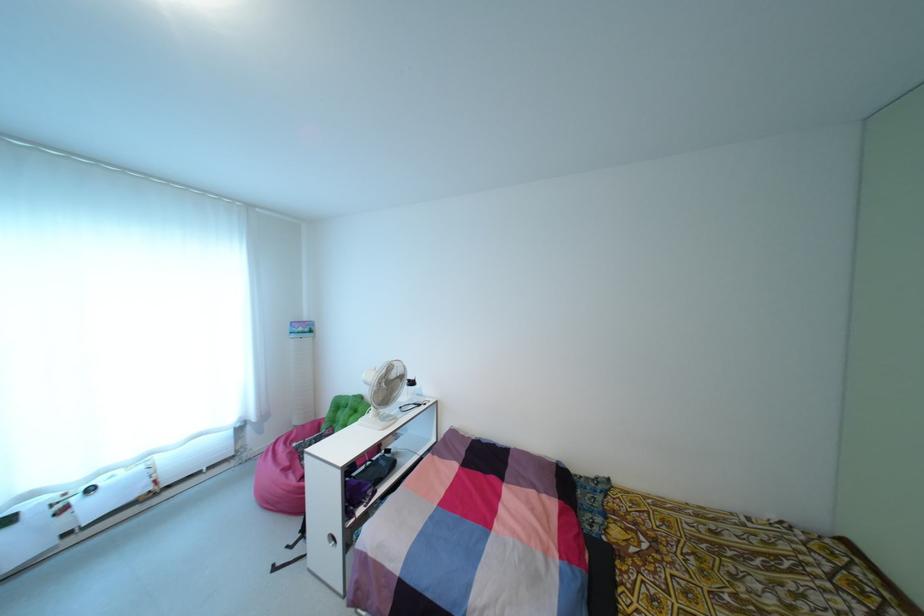
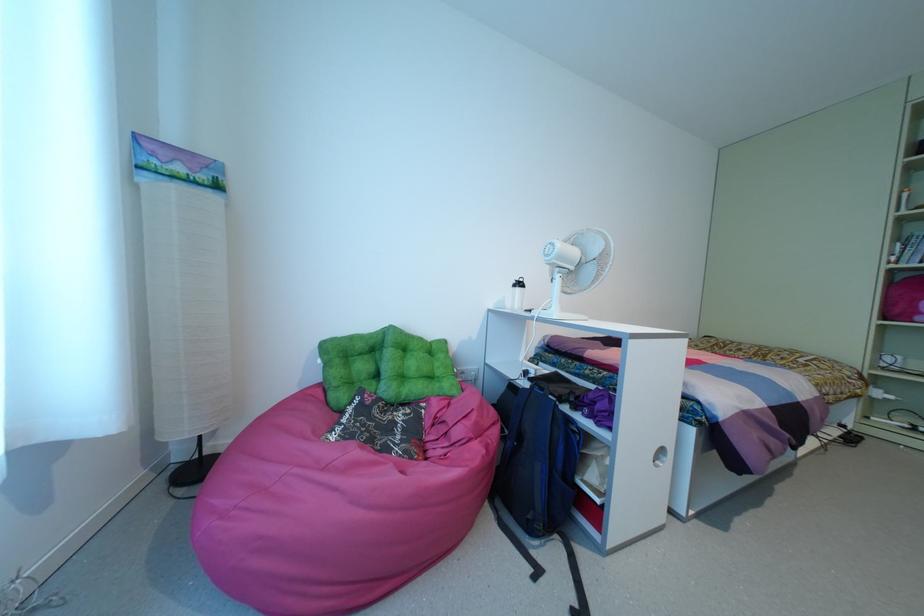
Find the pixel in the second image that matches (x=349, y=416) in the first image.

(402, 358)